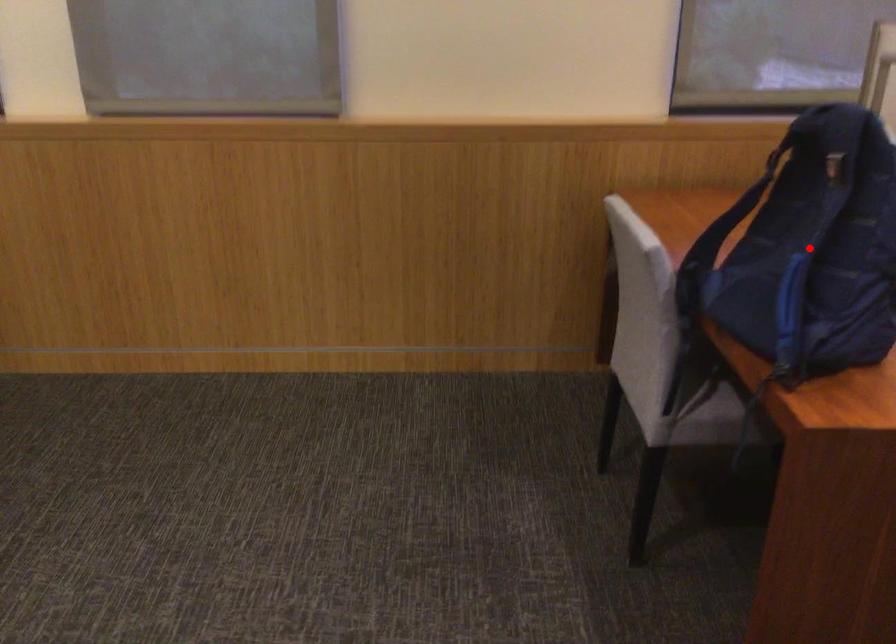
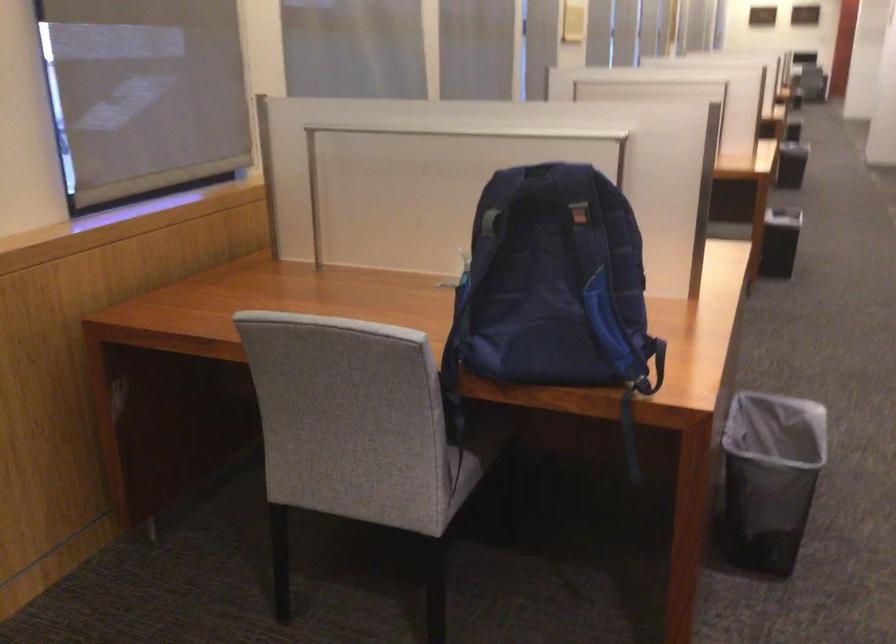
Question: I am providing you with two images of the same scene from different viewpoints. A red point is marked on the first image. Can you still see the location of the red point in image 2?

Choices:
 (A) Yes
 (B) No

Answer: (A)